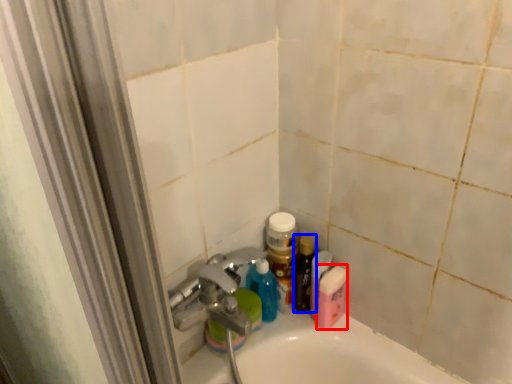
Question: Among these objects, which one is nearest to the camera, mouthwash (highlighted by a red box) or toiletry (highlighted by a blue box)?

Choices:
 (A) mouthwash
 (B) toiletry

Answer: (A)